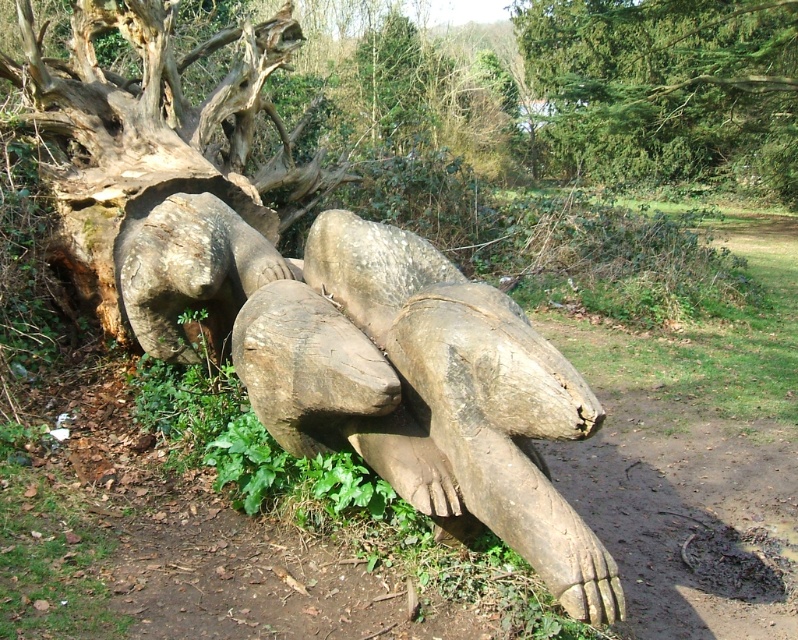
You are an artist planning to paint the scene. You want to capture the rough bark tree trunk at center and the green textured tree at upper center in your painting. Which tree should you focus on first to ensure it appears in the foreground of your painting?

The green textured tree at upper center should be focused on first because it is in front of the rough bark tree trunk at center, making it the foreground element.

You are an artist planning to create a new piece that will complement the existing natural wood sculpture at center and rough bark tree trunk at center in the scene. Based on their sizes, which object should you use as a reference for scale when designing your artwork?

The natural wood sculpture at center is larger in size than the rough bark tree trunk at center, so you should use the natural wood sculpture at center as the reference for scale to ensure your artwork harmonizes with the larger existing piece.